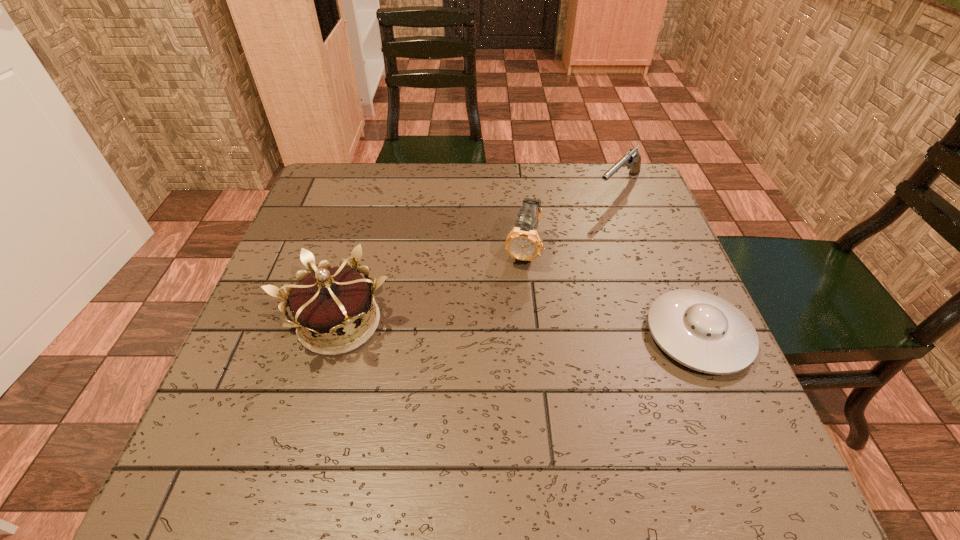
Where is `vacant space on the desktop that is between the leftmost object and the shortest object and is positioned on the face of the third nearest object`? The width and height of the screenshot is (960, 540). vacant space on the desktop that is between the leftmost object and the shortest object and is positioned on the face of the third nearest object is located at coordinates (502, 328).

Image resolution: width=960 pixels, height=540 pixels. In order to click on free space on the desktop that is between the crown and the shortest object and is positioned aiming along the barrel of the second shortest object in this screenshot , I will do `click(476, 328)`.